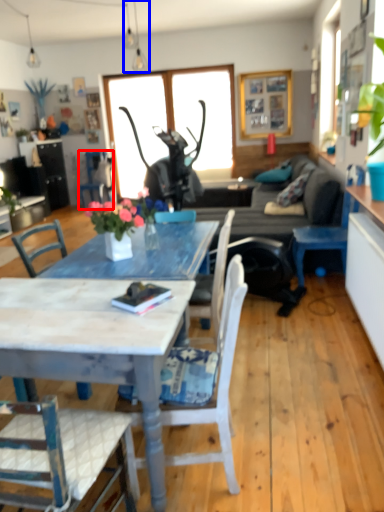
Question: Which of the following is the farthest to the observer, chair (highlighted by a red box) or lamp (highlighted by a blue box)?

Choices:
 (A) chair
 (B) lamp

Answer: (A)